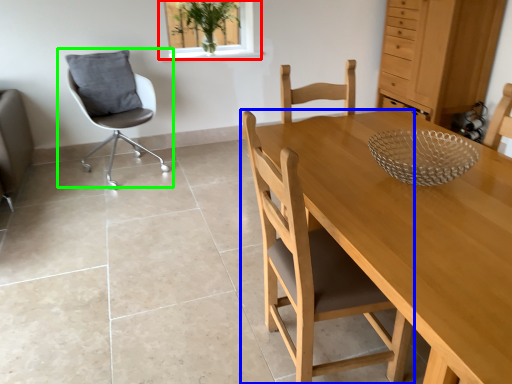
Question: Which object is the farthest from window (highlighted by a red box)? Choose among these: chair (highlighted by a blue box) or chair (highlighted by a green box).

Choices:
 (A) chair
 (B) chair

Answer: (A)